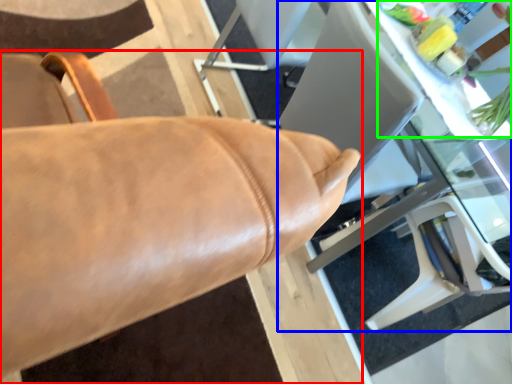
Question: Considering the real-world distances, which object is farthest from chair (highlighted by a red box)? table (highlighted by a blue box) or floral arrangement (highlighted by a green box)?

Choices:
 (A) table
 (B) floral arrangement

Answer: (B)